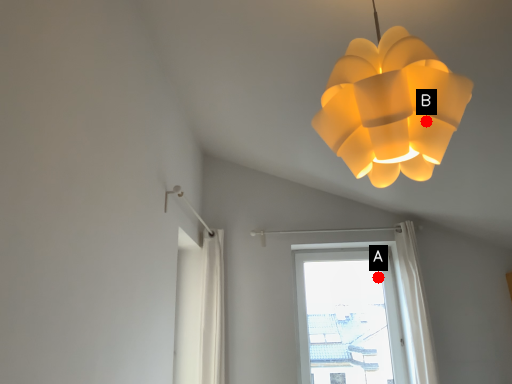
Question: Two points are circled on the image, labeled by A and B beside each circle. Which point is closer to the camera?

Choices:
 (A) A is closer
 (B) B is closer

Answer: (B)